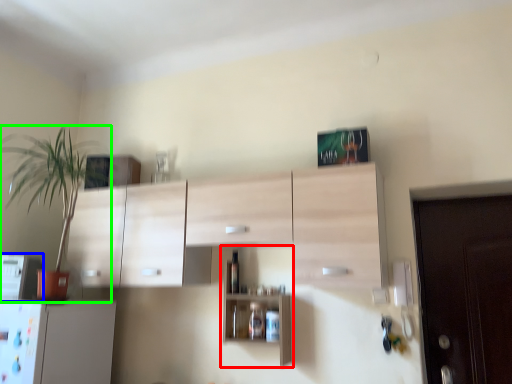
Question: Considering the real-world distances, which object is farthest from shelf (highlighted by a red box)? appliance (highlighted by a blue box) or houseplant (highlighted by a green box)?

Choices:
 (A) appliance
 (B) houseplant

Answer: (B)